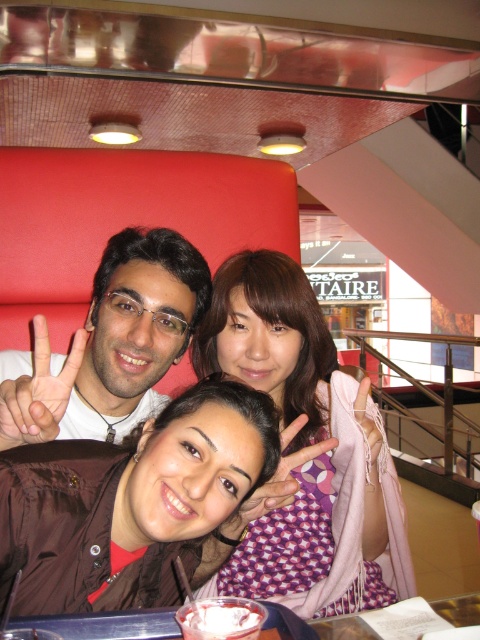
Can you confirm if purple dotted scarf at center is bigger than matte black hand at center?

Indeed, purple dotted scarf at center has a larger size compared to matte black hand at center.

Does purple dotted scarf at center come behind matte black hand at center?

Yes, it is behind matte black hand at center.

Find the location of `purple dotted scarf at center`. purple dotted scarf at center is located at coordinates (304, 449).

Find the location of a particular element. This screenshot has width=480, height=640. purple dotted scarf at center is located at coordinates tap(304, 449).

Does matte white shirt at center appear under matte black hand at center?

Incorrect, matte white shirt at center is not positioned below matte black hand at center.

Who is shorter, matte white shirt at center or matte black hand at center?

With less height is matte black hand at center.

Is point (144, 292) farther from camera compared to point (54, 426)?

Yes, it is.

The height and width of the screenshot is (640, 480). I want to click on matte white shirt at center, so click(x=111, y=342).

How distant is purple dotted scarf at center from matte white shirt at center?

They are 9.97 inches apart.

Does purple dotted scarf at center have a greater width compared to matte white shirt at center?

Yes, purple dotted scarf at center is wider than matte white shirt at center.

Where is `purple dotted scarf at center`? purple dotted scarf at center is located at coordinates (304, 449).